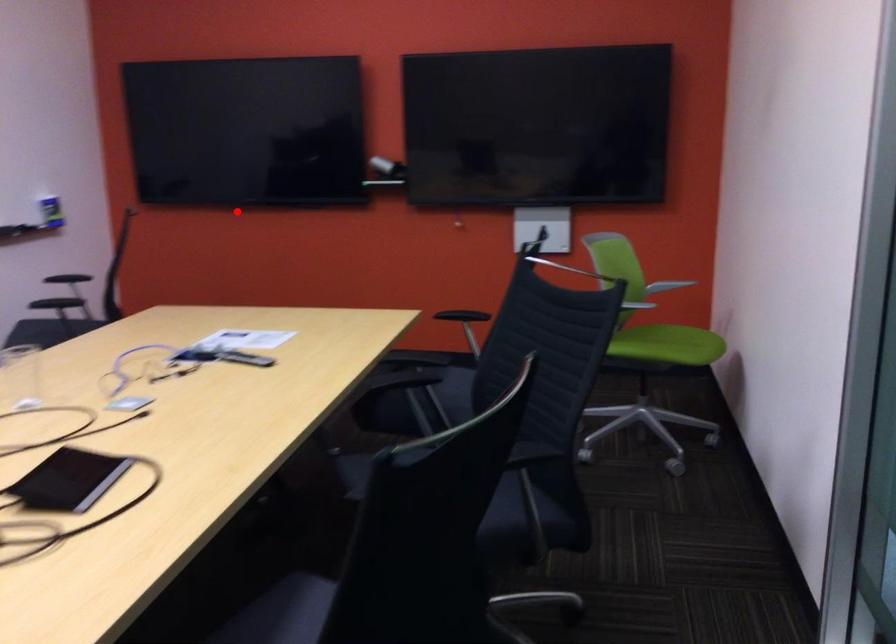
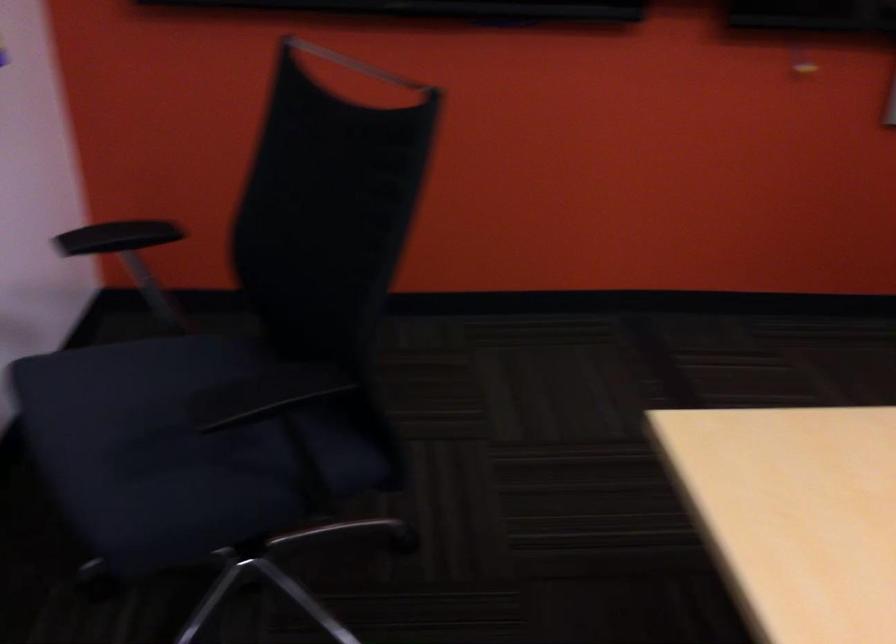
In the second image, find the point that corresponds to the highlighted location in the first image.

(356, 64)